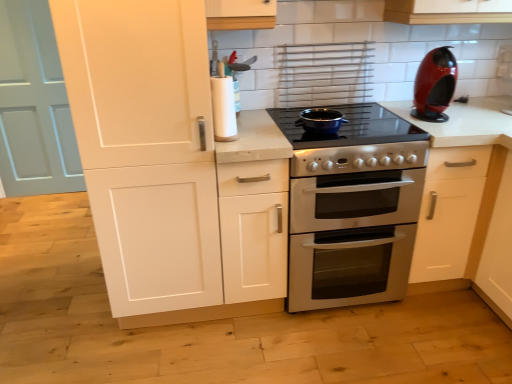
Find the location of `unoccupied region to the right of glossy plastic coffee machine at upper right`. unoccupied region to the right of glossy plastic coffee machine at upper right is located at coordinates 463,113.